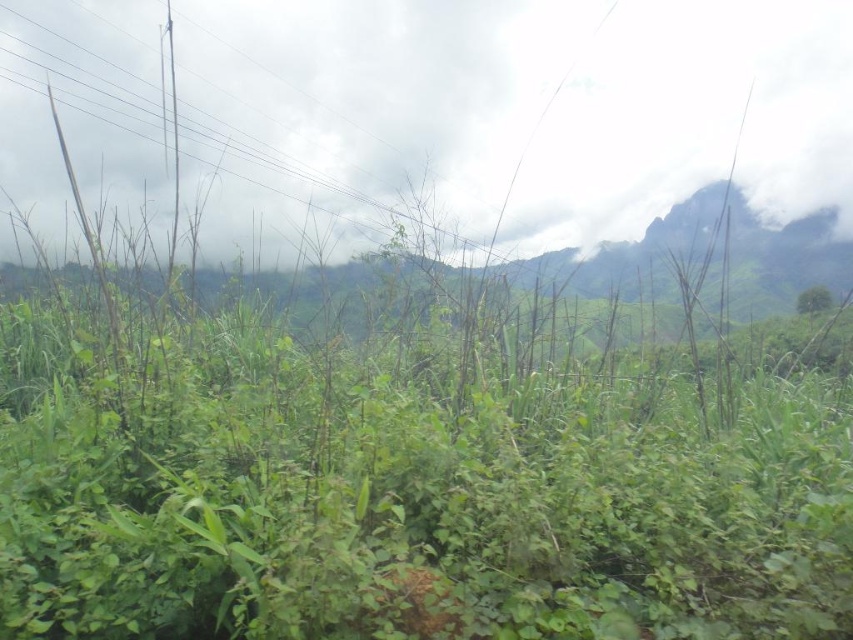
Question: Does white fluffy cloud at upper center have a lesser width compared to green leafy tree at center?

Choices:
 (A) no
 (B) yes

Answer: (A)

Question: Does white fluffy cloud at upper center appear on the left side of green leafy tree at center?

Choices:
 (A) no
 (B) yes

Answer: (B)

Question: Which of the following is the farthest from the observer?

Choices:
 (A) (656, 205)
 (B) (813, 298)

Answer: (A)

Question: Which object is farther from the camera taking this photo?

Choices:
 (A) green leafy tree at center
 (B) white fluffy cloud at upper center

Answer: (A)

Question: Does white fluffy cloud at upper center have a larger size compared to green leafy tree at center?

Choices:
 (A) no
 (B) yes

Answer: (B)